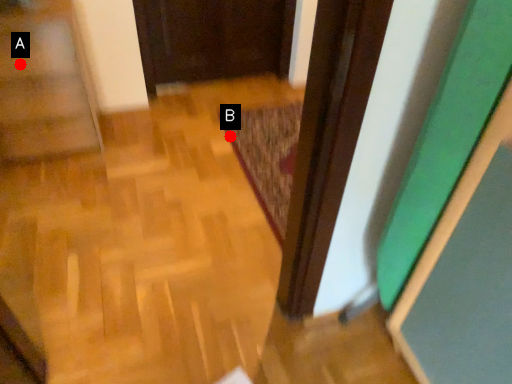
Question: Two points are circled on the image, labeled by A and B beside each circle. Which point is farther from the camera taking this photo?

Choices:
 (A) A is further
 (B) B is further

Answer: (B)